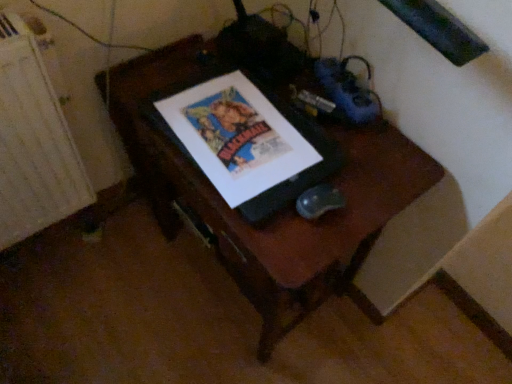
Locate an element on the screen. free region under white textured radiator at left (from a real-world perspective) is located at coordinates (58, 248).